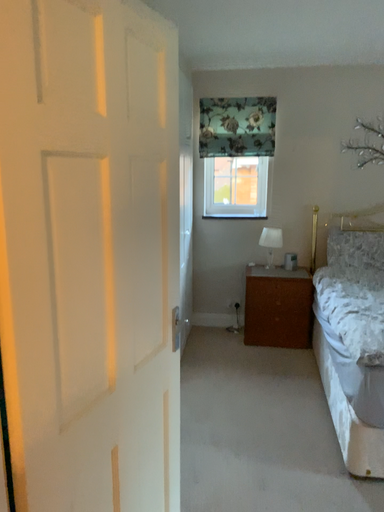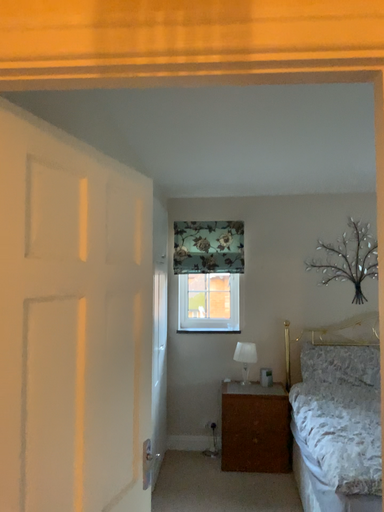
Question: Which way did the camera rotate in the video?

Choices:
 (A) rotated downward
 (B) rotated upward

Answer: (B)